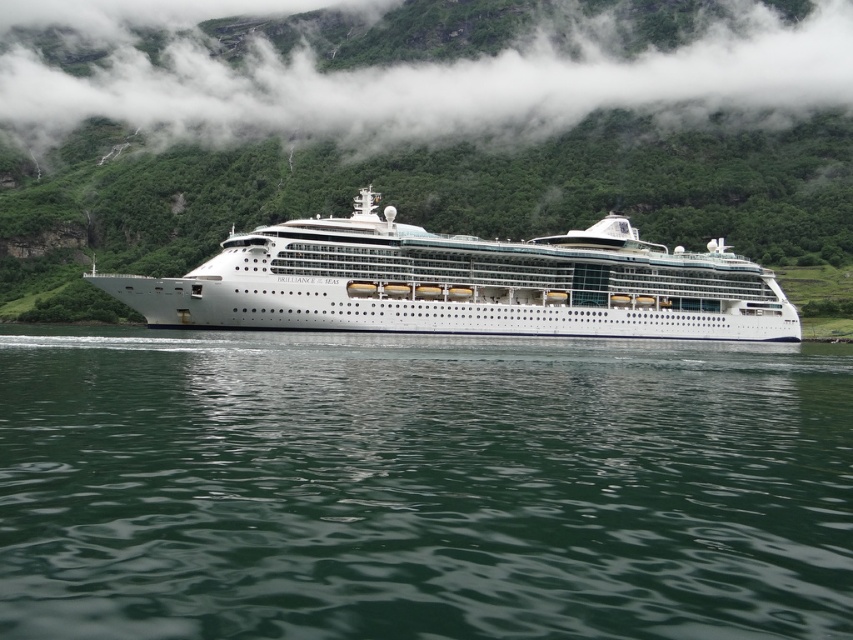
You are standing on the deck of the cruise ship Brilliance of the Seas and notice two points marked on the water surface. The first point is at coordinate point [837,387] and the second is at point [704,106]. Which point is closer to you?

Point [837,387] is closer to the viewer than point [704,106].

You are standing on the deck of the cruise ship Brilliance of the Seas and want to locate the green liquid water at center. Where should you look relative to the ship?

The green liquid water at center is located at the coordinates 0.761 on the x axis and 0.495 on the y axis relative to the ship.